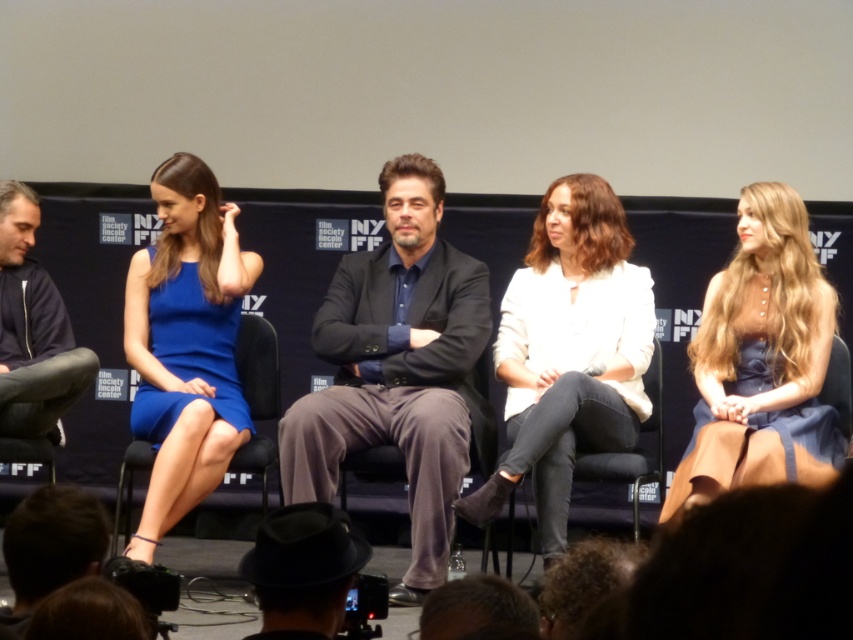
You are a photographer at the event and want to capture a clear photo of both the white matte blazer at center and the blue satin dress at left. Since you can only focus on one subject at a time, which one should you focus on to ensure the other appears in the background?

You should focus on the white matte blazer at center because it is in front of the blue satin dress at left, so the latter will naturally be in the background.